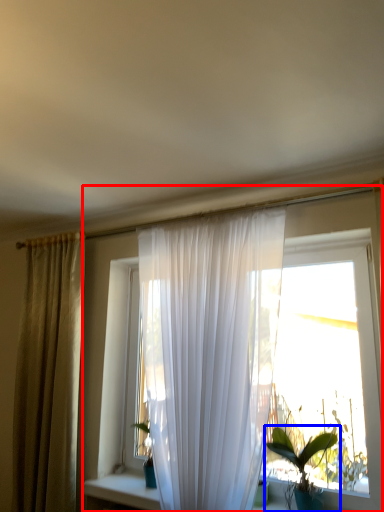
Question: Which object is closer to the camera taking this photo, window (highlighted by a red box) or houseplant (highlighted by a blue box)?

Choices:
 (A) window
 (B) houseplant

Answer: (A)